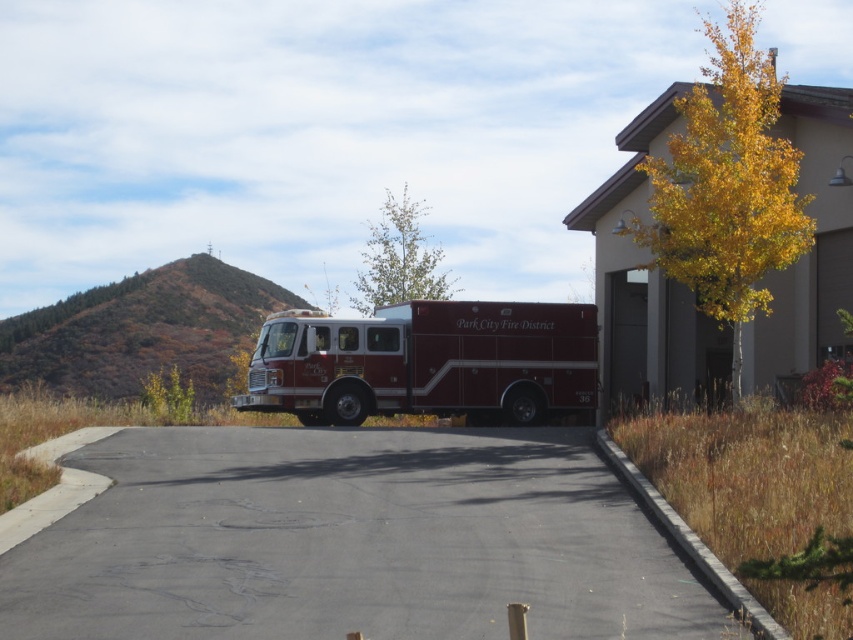
You are a fire truck driver who just arrived at the fire station. You need to park your fire truck on the black asphalt driveway at center. Based on the coordinates provided, can you confirm if the driveway is positioned correctly for parking?

The black asphalt driveway at center is positioned at coordinates point (352,541), which is suitable for parking the fire truck as it aligns with the standard parking requirements for such vehicles.

In the scene shown: You are a delivery driver arriving at the fire station and need to park your truck, which is 2 meters wide, on the black asphalt driveway at center. Can your truck fit on the driveway without overlapping the shiny red fire truck at center?

The black asphalt driveway at center is narrower than the shiny red fire truck at center, so your truck cannot fit on the driveway without overlapping the shiny red fire truck at center since the driveway is not wide enough.